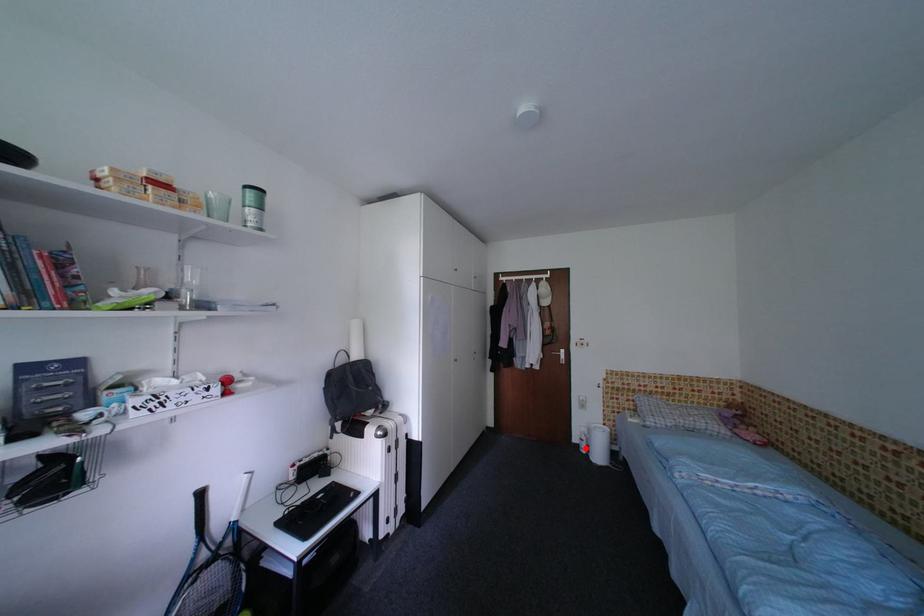
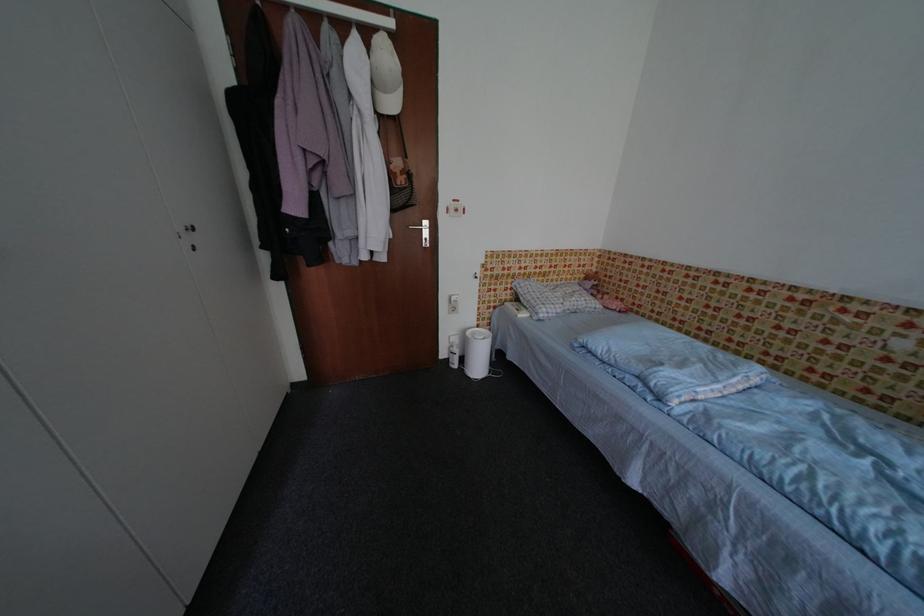
Find the pixel in the second image that matches the highlighted location in the first image.

(455, 363)